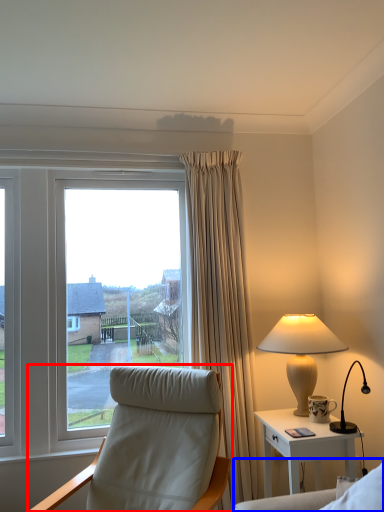
Question: Which object appears farthest to the camera in this image, chair (highlighted by a red box) or couch (highlighted by a blue box)?

Choices:
 (A) chair
 (B) couch

Answer: (A)